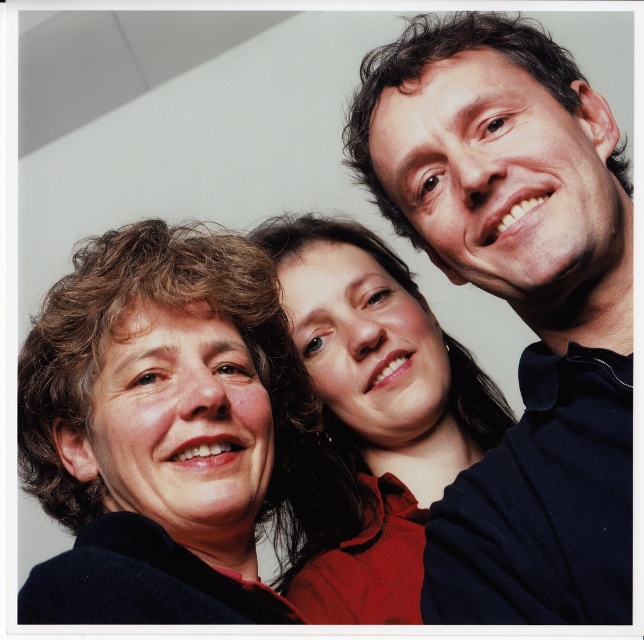
Which of these two, matte black shirt at upper right or smooth red shirt at center, stands taller?

matte black shirt at upper right

Who is more forward, (466,141) or (298,256)?

Positioned in front is point (466,141).

Where is `matte black shirt at upper right`? This screenshot has height=640, width=644. matte black shirt at upper right is located at coordinates (518, 305).

Is matte black jacket at left bigger than smooth red shirt at center?

Incorrect, matte black jacket at left is not larger than smooth red shirt at center.

Can you confirm if matte black jacket at left is positioned above smooth red shirt at center?

No, matte black jacket at left is not above smooth red shirt at center.

Which is behind, point (93, 563) or point (464, 456)?

Point (464, 456)

This screenshot has width=644, height=640. Find the location of `matte black jacket at left`. matte black jacket at left is located at coordinates (158, 428).

Is matte black shirt at upper right taller than matte black jacket at left?

Yes, matte black shirt at upper right is taller than matte black jacket at left.

Who is more forward, (x=538, y=532) or (x=204, y=552)?

Point (x=538, y=532) is in front.

Is point (611, 593) positioned in front of point (113, 604)?

No, it is not.

Image resolution: width=644 pixels, height=640 pixels. What are the coordinates of `matte black shirt at upper right` in the screenshot? It's located at (518, 305).